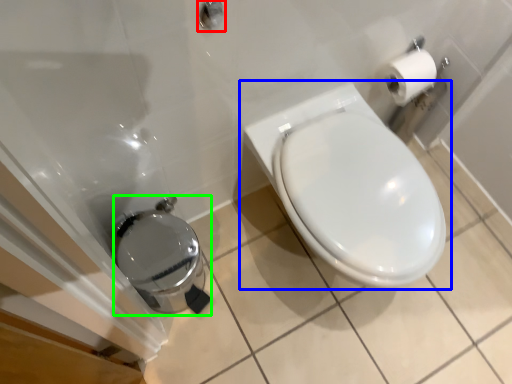
Question: Which object is positioned farthest from shower (highlighted by a red box)? Select from toilet (highlighted by a blue box) and porcelain (highlighted by a green box).

Choices:
 (A) toilet
 (B) porcelain

Answer: (B)